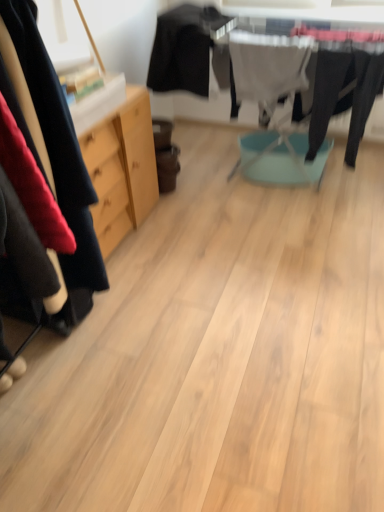
The width and height of the screenshot is (384, 512). Identify the location of free space above black fabric at upper center, placed as the first clothing when sorted from left to right (from a real-world perspective). (195, 3).